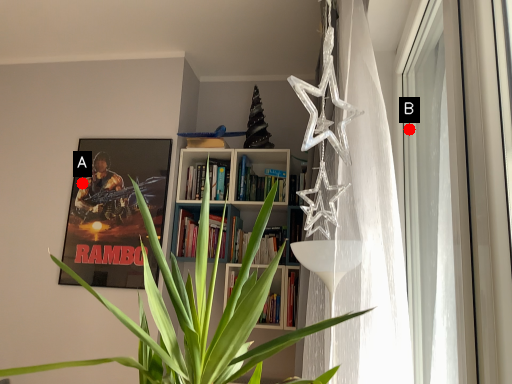
Question: Two points are circled on the image, labeled by A and B beside each circle. Which of the following is the farthest from the observer?

Choices:
 (A) A is further
 (B) B is further

Answer: (A)